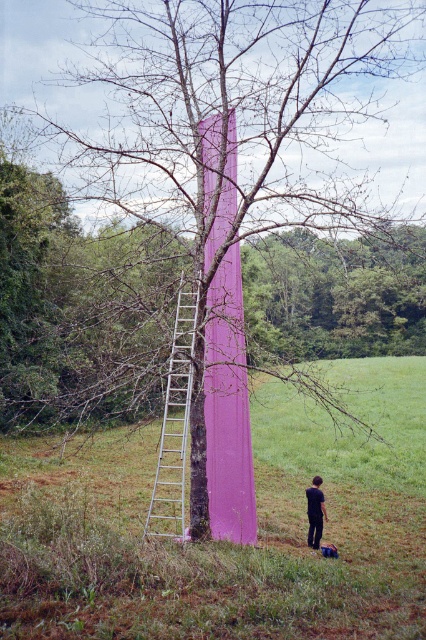
Is pink matte tower at center taller than silver metallic ladder at center?

Indeed, pink matte tower at center has a greater height compared to silver metallic ladder at center.

Between pink matte tower at center and silver metallic ladder at center, which one appears on the right side from the viewer's perspective?

pink matte tower at center is more to the right.

Which is in front, point (121, 529) or point (166, 508)?

Point (121, 529) is more forward.

Image resolution: width=426 pixels, height=640 pixels. Identify the location of pink matte tower at center. (224, 541).

Can you confirm if silver metallic ladder at center is smaller than black matte pants at lower right?

Indeed, silver metallic ladder at center has a smaller size compared to black matte pants at lower right.

Is silver metallic ladder at center above black matte pants at lower right?

No, silver metallic ladder at center is not above black matte pants at lower right.

The width and height of the screenshot is (426, 640). What do you see at coordinates (175, 426) in the screenshot?
I see `silver metallic ladder at center` at bounding box center [175, 426].

Image resolution: width=426 pixels, height=640 pixels. Find the location of `silver metallic ladder at center`. silver metallic ladder at center is located at coordinates (175, 426).

Which of these two, pink matte tower at center or black matte pants at lower right, stands shorter?

With less height is black matte pants at lower right.

Between pink matte tower at center and black matte pants at lower right, which one is positioned higher?

pink matte tower at center is higher up.

Where is `pink matte tower at center`? pink matte tower at center is located at coordinates (224, 541).